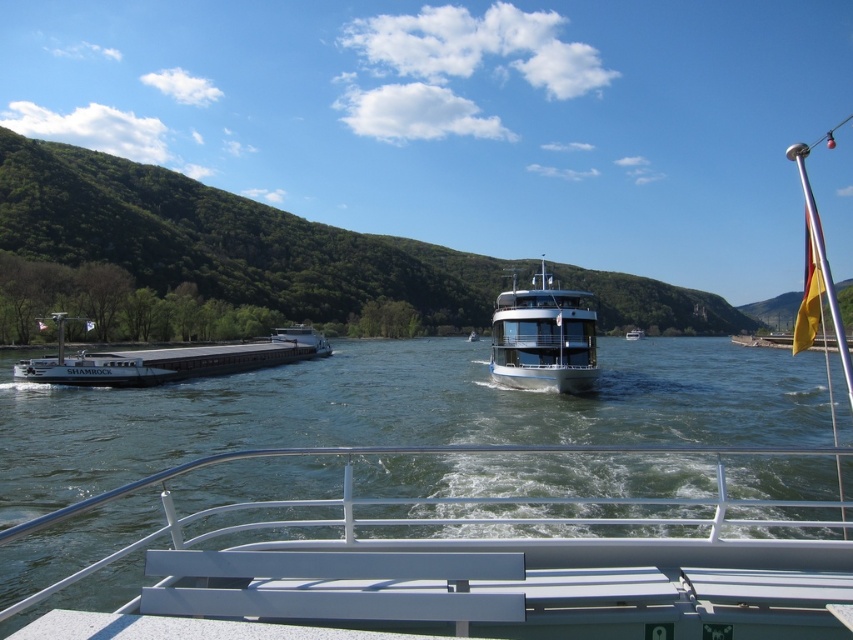
Which is more to the left, green water at center or white glossy boat at center?

Positioned to the left is green water at center.

Is green water at center wider than white glossy boat at center?

Indeed, green water at center has a greater width compared to white glossy boat at center.

Who is more distant from viewer, [463,353] or [630,337]?

The point [630,337] is behind.

Identify the location of green water at center. The image size is (853, 640). (397, 410).

How far apart are green water at center and metallic silver boat at center?

green water at center and metallic silver boat at center are 31.56 feet apart from each other.

Which is above, green water at center or metallic silver boat at center?

metallic silver boat at center

The image size is (853, 640). What do you see at coordinates (397, 410) in the screenshot?
I see `green water at center` at bounding box center [397, 410].

You are a GUI agent. You are given a task and a screenshot of the screen. Output one action in this format:
    pyautogui.click(x=<x>, y=<y>)
    Task: Click on the green water at center
    This screenshot has width=853, height=640.
    Given the screenshot: What is the action you would take?
    (x=397, y=410)

Does metallic silver boat at center appear on the right side of matte gray barge at left?

Yes, metallic silver boat at center is to the right of matte gray barge at left.

Who is positioned more to the left, metallic silver boat at center or matte gray barge at left?

From the viewer's perspective, matte gray barge at left appears more on the left side.

I want to click on metallic silver boat at center, so click(x=543, y=337).

Image resolution: width=853 pixels, height=640 pixels. I want to click on metallic silver boat at center, so click(x=543, y=337).